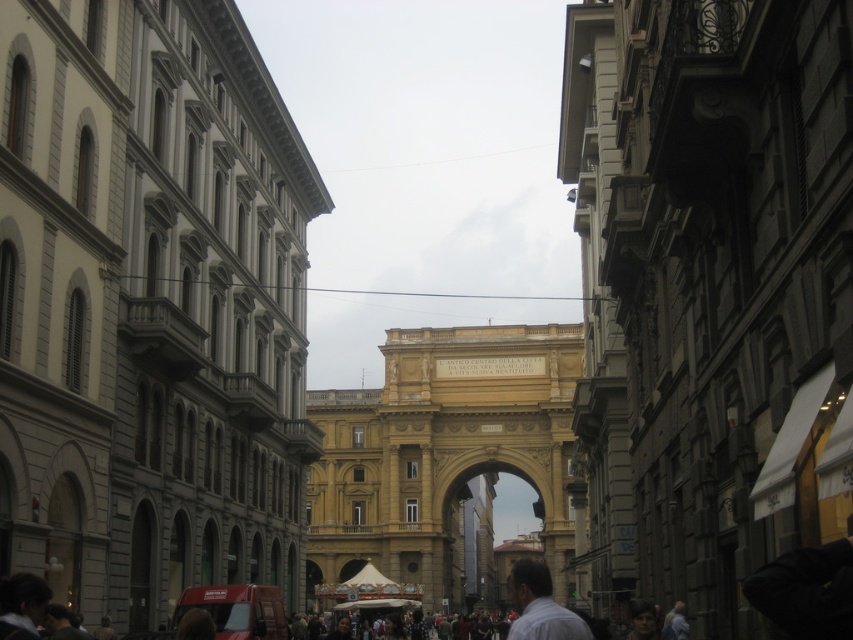
You are standing in the bustling urban scene and see a point marked at coordinates (21,605). Which object in the scene does this point correspond to?

The point at coordinates (21,605) corresponds to the dark brown hair at lower left.

You are a photographer standing in the middle of the street. You want to capture both the yellow stone archway at center and the light brown hair at lower right in a single frame. Which object will appear wider in your photo?

The yellow stone archway at center will appear wider in the photo because its width surpasses that of the light brown hair at lower right.

From the picture: You are a photographer standing at the camera position in the scene. You want to capture a closeup shot of the dark brown hair at lower left. Given that your telephoto lens can focus on objects within 50 meters, will you be able to take the photo?

The dark brown hair at lower left is 45.52 meters from the camera, which is within the 50 meters range of the telephoto lens. Yes, you can take the photo.